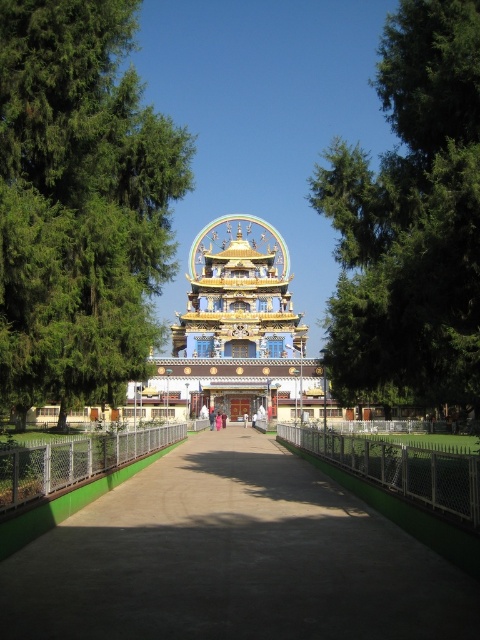
Does green leafy tree at upper left appear on the left side of golden ornate temple at center?

Yes, green leafy tree at upper left is to the left of golden ornate temple at center.

Between point (23, 10) and point (207, 240), which one is positioned in front?

Point (23, 10)

Does point (32, 260) come farther from viewer compared to point (251, 227)?

No, it is not.

Where is `green leafy tree at upper left`? green leafy tree at upper left is located at coordinates (80, 204).

Can you confirm if green leafy tree at upper center is thinner than golden ornate temple at center?

Indeed, green leafy tree at upper center has a lesser width compared to golden ornate temple at center.

Does green leafy tree at upper center come in front of golden ornate temple at center?

Yes, green leafy tree at upper center is in front of golden ornate temple at center.

Which is behind, point (457, 234) or point (238, 344)?

Positioned behind is point (238, 344).

Find the location of `green leafy tree at upper center`. green leafy tree at upper center is located at coordinates (410, 220).

Looking at this image, does green leafy tree at upper left have a lesser width compared to green leafy tree at upper center?

Correct, green leafy tree at upper left's width is less than green leafy tree at upper center's.

Does point (98, 384) come farther from viewer compared to point (365, 202)?

No, (98, 384) is closer to viewer.

Where is `green leafy tree at upper left`? The image size is (480, 640). green leafy tree at upper left is located at coordinates (80, 204).

You are a GUI agent. You are given a task and a screenshot of the screen. Output one action in this format:
    pyautogui.click(x=<x>, y=<y>)
    Task: Click on the green leafy tree at upper left
    The width and height of the screenshot is (480, 640).
    Given the screenshot: What is the action you would take?
    pyautogui.click(x=80, y=204)